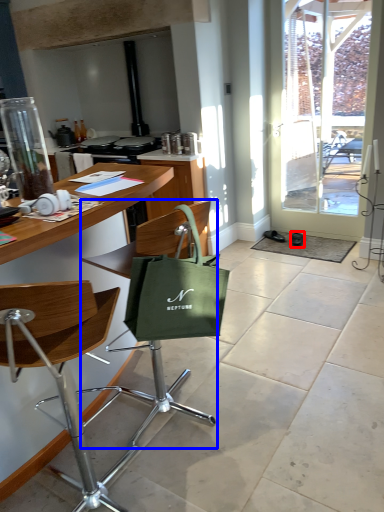
Question: Which object is further to the camera taking this photo, footwear (highlighted by a red box) or chair (highlighted by a blue box)?

Choices:
 (A) footwear
 (B) chair

Answer: (A)